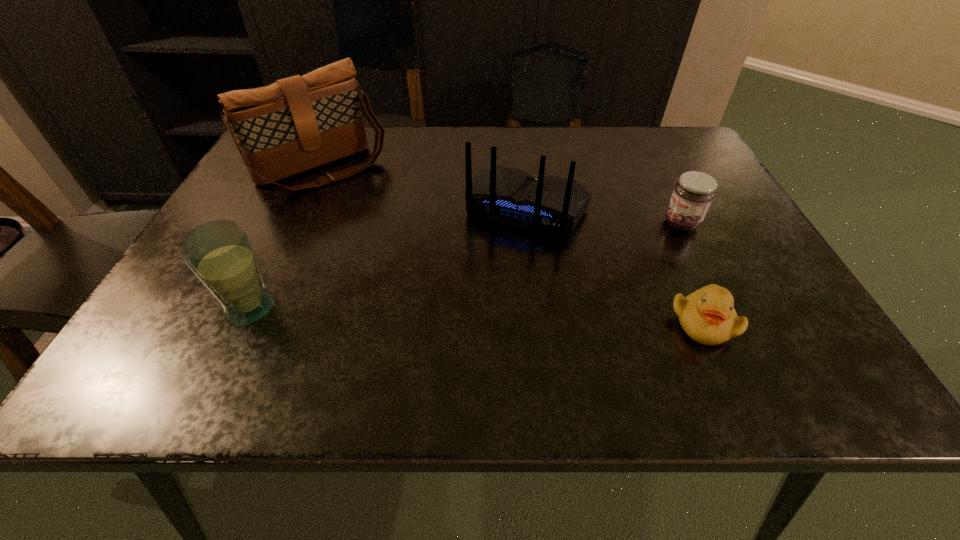
The height and width of the screenshot is (540, 960). I want to click on free region that satisfies the following two spatial constraints: 1. on the back side of the glass; 2. on the left side of the second shortest object, so click(x=291, y=224).

Where is `vacant space that satisfies the following two spatial constraints: 1. on the front side of the fourth tallest object; 2. on the right side of the tallest object`? The height and width of the screenshot is (540, 960). vacant space that satisfies the following two spatial constraints: 1. on the front side of the fourth tallest object; 2. on the right side of the tallest object is located at coordinates (299, 224).